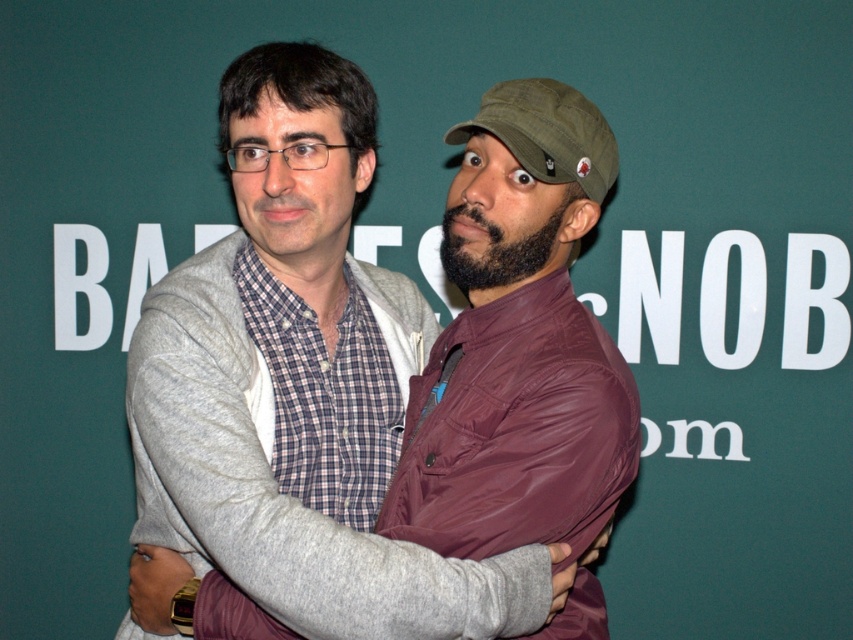
Question: Which point is closer to the camera?

Choices:
 (A) (514, 417)
 (B) (537, 172)

Answer: (A)

Question: Does matte gray hoodie at center appear over green fabric baseball cap at upper right?

Choices:
 (A) yes
 (B) no

Answer: (B)

Question: Which of the following is the closest to the observer?

Choices:
 (A) green fabric baseball cap at upper right
 (B) matte gray hoodie at center

Answer: (B)

Question: Is matte gray hoodie at center bigger than green fabric baseball cap at upper right?

Choices:
 (A) yes
 (B) no

Answer: (A)

Question: Is matte gray hoodie at center positioned at the back of green fabric baseball cap at upper right?

Choices:
 (A) no
 (B) yes

Answer: (A)